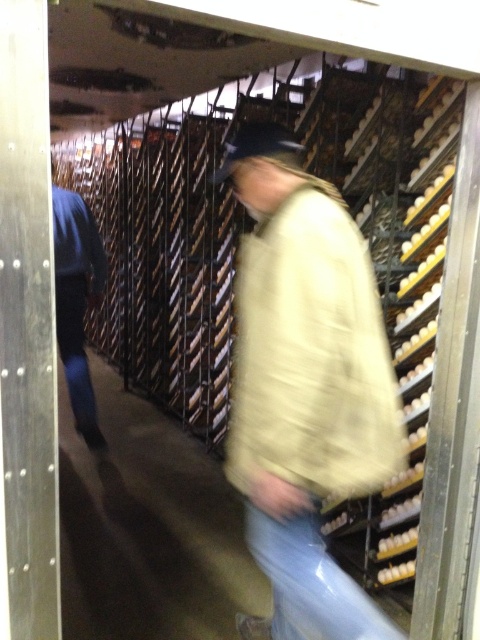
Can you confirm if beige woolen jacket at center is positioned to the left of blue denim jeans at left?

In fact, beige woolen jacket at center is to the right of blue denim jeans at left.

Image resolution: width=480 pixels, height=640 pixels. Describe the element at coordinates (305, 385) in the screenshot. I see `beige woolen jacket at center` at that location.

Where is `beige woolen jacket at center`? The width and height of the screenshot is (480, 640). beige woolen jacket at center is located at coordinates (305, 385).